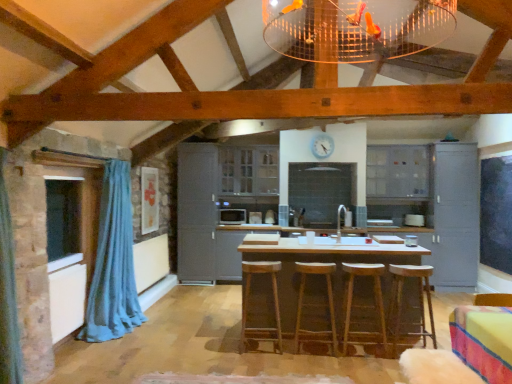
Question: Based on their positions, is wooden bar stool at center located to the left or right of wooden bar stool at center, marked as the 1th bar stool in a right-to-left arrangement?

Choices:
 (A) left
 (B) right

Answer: (B)

Question: In terms of width, does wooden bar stool at center look wider or thinner when compared to wooden bar stool at center, marked as the 1th bar stool in a right-to-left arrangement?

Choices:
 (A) wide
 (B) thin

Answer: (A)

Question: Which of these objects is positioned closest to the wooden bar stool at center, placed as the fourth bar stool when sorted from left to right?

Choices:
 (A) matte gray cabinet at right, positioned as the 1th cabinetry in right-to-left order
 (B) matte gray cabinet at center, the fourth cabinetry when ordered from right to left
 (C) wooden bar stool at center
 (D) matte gray cabinets at upper right, the 3th cabinetry viewed from the left
 (E) brown wooden bar stool at center, arranged as the 4th bar stool when viewed from the right

Answer: (C)

Question: Which object is the closest to the matte gray cabinet at center, the 1th cabinetry when ordered from left to right?

Choices:
 (A) blue fabric curtain at left
 (B) brown wooden bar stool at center, arranged as the 4th bar stool when viewed from the right
 (C) matte gray cabinets at center, arranged as the 3th cabinetry when viewed from the right
 (D) matte gray cabinet at right, positioned as the 1th cabinetry in right-to-left order
 (E) transparent glass window at left

Answer: (C)